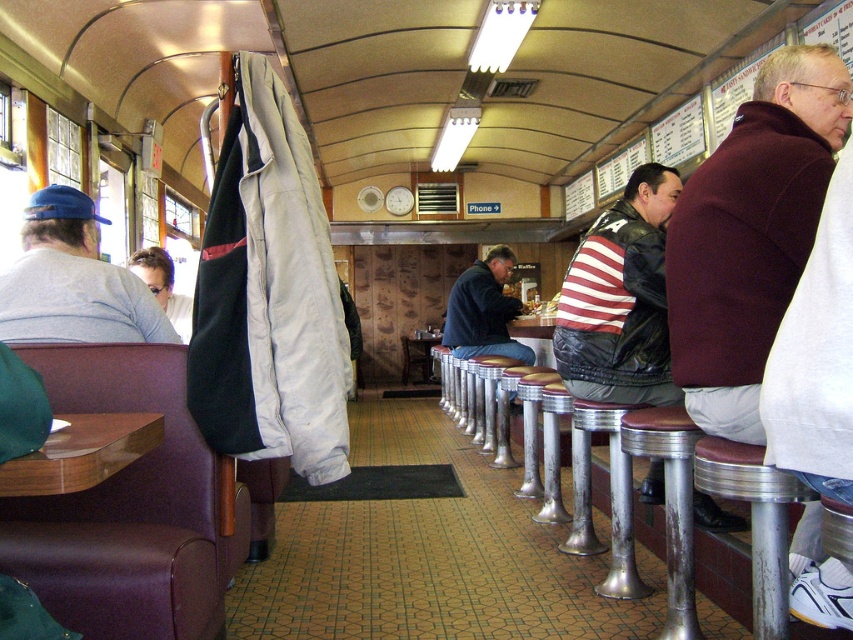
Does dark blue leather jacket at center appear on the left side of metallic silver table at center?

Yes, dark blue leather jacket at center is to the left of metallic silver table at center.

Is dark blue leather jacket at center thinner than metallic silver table at center?

No, dark blue leather jacket at center is not thinner than metallic silver table at center.

Is point (521, 301) farther from viewer compared to point (526, 316)?

Yes.

You are a GUI agent. You are given a task and a screenshot of the screen. Output one action in this format:
    pyautogui.click(x=<x>, y=<y>)
    Task: Click on the dark blue leather jacket at center
    The width and height of the screenshot is (853, 640).
    Given the screenshot: What is the action you would take?
    pyautogui.click(x=483, y=310)

Does point (126, 300) come farther from viewer compared to point (527, 321)?

No.

From the picture: Who is shorter, gray cotton shirt at left or metallic silver table at center?

metallic silver table at center

Where is `gray cotton shirt at left`? The width and height of the screenshot is (853, 640). gray cotton shirt at left is located at coordinates (73, 280).

You are a GUI agent. You are given a task and a screenshot of the screen. Output one action in this format:
    pyautogui.click(x=<x>, y=<y>)
    Task: Click on the gray cotton shirt at left
    This screenshot has height=640, width=853.
    Given the screenshot: What is the action you would take?
    coord(73,280)

Does striped leather jacket at center lie behind dark blue leather jacket at center?

No, striped leather jacket at center is closer to the viewer.

Can you confirm if striped leather jacket at center is taller than dark blue leather jacket at center?

Yes.

Measure the distance between striped leather jacket at center and camera.

The distance of striped leather jacket at center from camera is 9.19 feet.

Where is `striped leather jacket at center`? striped leather jacket at center is located at coordinates (619, 298).